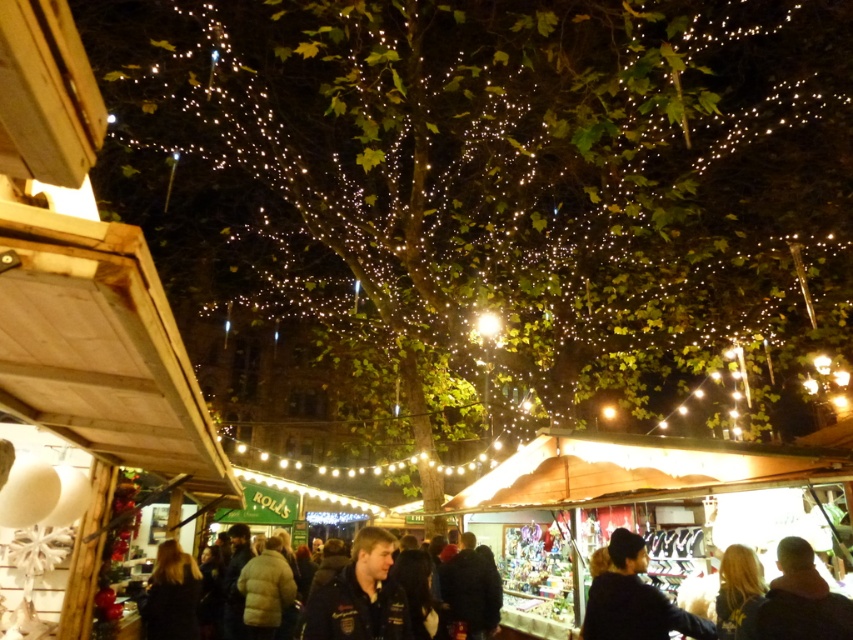
Question: Is dark blue knit hat at center bigger than dark brown hair at center?

Choices:
 (A) no
 (B) yes

Answer: (A)

Question: Which of the following is the closest to the observer?

Choices:
 (A) dark blue knit hat at center
 (B) dark brown hair at center
 (C) dark brown leather jacket at lower right
 (D) dark blue jacket at center

Answer: (C)

Question: Based on their relative distances, which object is farther from the dark brown leather jacket at lower right?

Choices:
 (A) dark blue jacket at center
 (B) dark blue knit hat at center

Answer: (A)

Question: Which object is farther from the camera taking this photo?

Choices:
 (A) dark blue knit hat at center
 (B) dark blue jacket at center
 (C) dark brown hair at center

Answer: (C)

Question: From the image, what is the correct spatial relationship of dark blue knit hat at center in relation to dark brown hair at center?

Choices:
 (A) left
 (B) right

Answer: (B)

Question: Does dark blue knit hat at center have a smaller size compared to dark brown leather jacket at lower right?

Choices:
 (A) yes
 (B) no

Answer: (B)